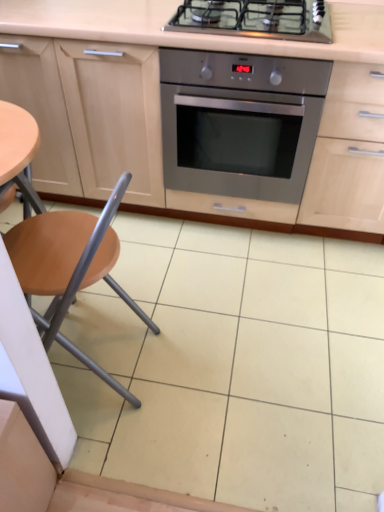
Question: Can you confirm if stainless steel oven at center is bigger than wooden seat at left?

Choices:
 (A) yes
 (B) no

Answer: (A)

Question: Is stainless steel oven at center wider than wooden seat at left?

Choices:
 (A) yes
 (B) no

Answer: (A)

Question: Is the position of stainless steel oven at center less distant than that of wooden seat at left?

Choices:
 (A) no
 (B) yes

Answer: (A)

Question: From a real-world perspective, is stainless steel oven at center located beneath wooden seat at left?

Choices:
 (A) no
 (B) yes

Answer: (A)

Question: From a real-world perspective, is stainless steel oven at center on wooden seat at left?

Choices:
 (A) yes
 (B) no

Answer: (A)

Question: In the image, is stainless steel oven at center positioned in front of or behind stainless steel gas stove at upper center?

Choices:
 (A) behind
 (B) front

Answer: (A)

Question: Considering the positions of stainless steel oven at center and stainless steel gas stove at upper center in the image, is stainless steel oven at center bigger or smaller than stainless steel gas stove at upper center?

Choices:
 (A) small
 (B) big

Answer: (B)

Question: From a real-world perspective, is stainless steel oven at center positioned above or below stainless steel gas stove at upper center?

Choices:
 (A) above
 (B) below

Answer: (B)

Question: Based on their positions, is stainless steel oven at center located to the left or right of stainless steel gas stove at upper center?

Choices:
 (A) right
 (B) left

Answer: (A)

Question: From a real-world perspective, is stainless steel gas stove at upper center physically located above or below wooden seat at left?

Choices:
 (A) above
 (B) below

Answer: (A)

Question: Looking at their shapes, would you say stainless steel gas stove at upper center is wider or thinner than wooden seat at left?

Choices:
 (A) thin
 (B) wide

Answer: (B)

Question: From the image's perspective, is stainless steel gas stove at upper center above or below wooden seat at left?

Choices:
 (A) below
 (B) above

Answer: (B)

Question: Considering their positions, is stainless steel gas stove at upper center located in front of or behind wooden seat at left?

Choices:
 (A) behind
 (B) front

Answer: (A)

Question: Would you say wooden seat at left is to the left or to the right of stainless steel oven at center in the picture?

Choices:
 (A) left
 (B) right

Answer: (A)

Question: From a real-world perspective, is wooden seat at left above or below stainless steel oven at center?

Choices:
 (A) above
 (B) below

Answer: (B)